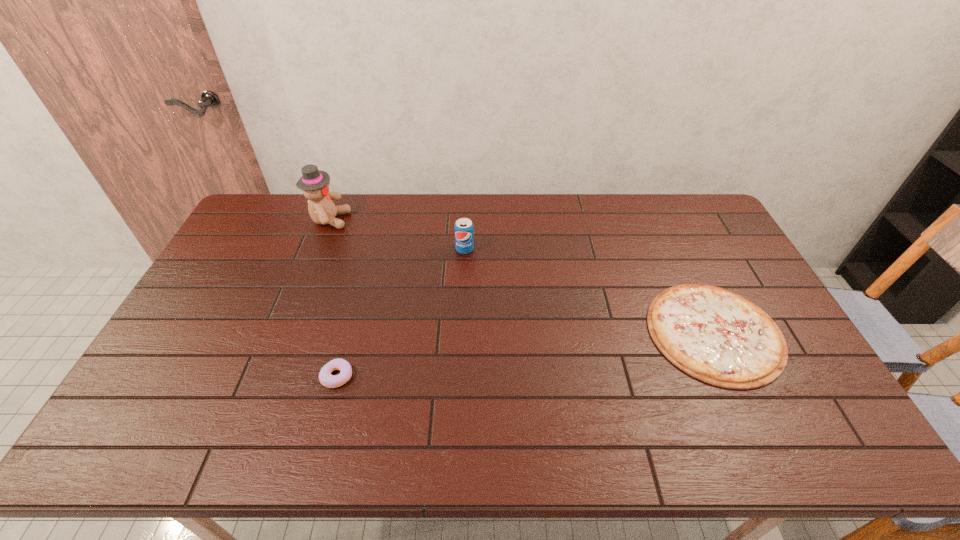
I want to click on free region located on the right of the third tallest object, so click(x=480, y=376).

Locate an element on the screen. free space located on the front of the rightmost object is located at coordinates (756, 419).

Where is `object present at the far edge`? object present at the far edge is located at coordinates (314, 183).

Where is `object that is positioned at the right edge`? Image resolution: width=960 pixels, height=540 pixels. object that is positioned at the right edge is located at coordinates (717, 336).

Image resolution: width=960 pixels, height=540 pixels. In order to click on blank space at the far edge of the desktop in this screenshot , I will do `click(517, 216)`.

In the image, there is a desktop. Where is `vacant space at the near edge`? The height and width of the screenshot is (540, 960). vacant space at the near edge is located at coordinates (481, 440).

In the image, there is a desktop. Where is `blank space at the left edge`? The width and height of the screenshot is (960, 540). blank space at the left edge is located at coordinates (203, 299).

In the image, there is a desktop. What are the coordinates of `vacant region at the far right corner` in the screenshot? It's located at (686, 228).

Identify the location of vacant area between the doughnut and the second tallest object. (401, 313).

This screenshot has width=960, height=540. I want to click on vacant space in between the second tallest object and the rag_doll, so click(x=397, y=234).